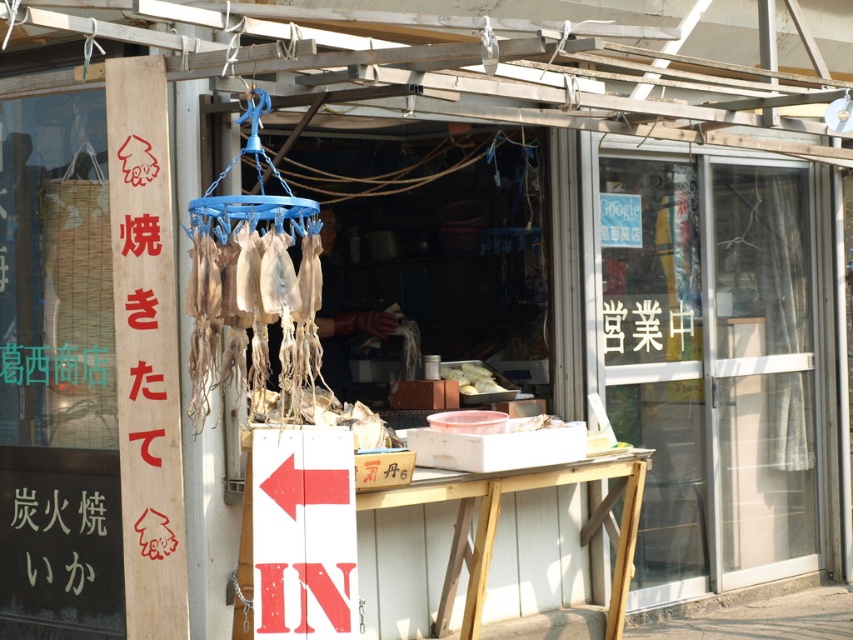
Question: Estimate the real-world distances between objects in this image. Which object is closer to the red wooden sign at lower left?

Choices:
 (A) dried beige squid at center
 (B) white matte food at center
 (C) transparent glass door at center

Answer: (A)

Question: Based on their relative distances, which object is farther from the dried beige squid at center?

Choices:
 (A) white matte food at center
 (B) red wooden sign at lower left

Answer: (A)

Question: Is red wooden sign at lower left further to camera compared to dried beige squid at center?

Choices:
 (A) yes
 (B) no

Answer: (A)

Question: Can you confirm if red wooden sign at lower left is smaller than white matte food at center?

Choices:
 (A) no
 (B) yes

Answer: (A)

Question: Is dried beige squid at center to the left of white matte food at center from the viewer's perspective?

Choices:
 (A) yes
 (B) no

Answer: (A)

Question: Estimate the real-world distances between objects in this image. Which object is closer to the dried beige squid at center?

Choices:
 (A) white matte food at center
 (B) transparent glass door at center

Answer: (A)